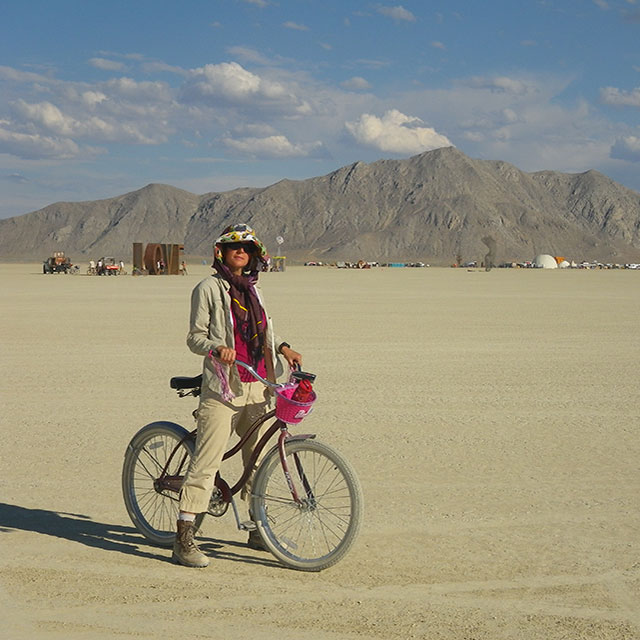
I want to click on basket, so click(x=296, y=418).